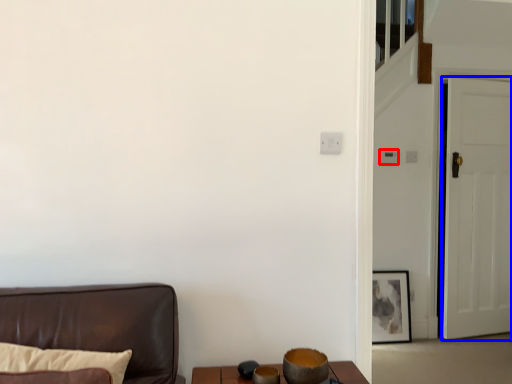
Question: Which of the following is the farthest to the observer, light switch (highlighted by a red box) or door (highlighted by a blue box)?

Choices:
 (A) light switch
 (B) door

Answer: (A)